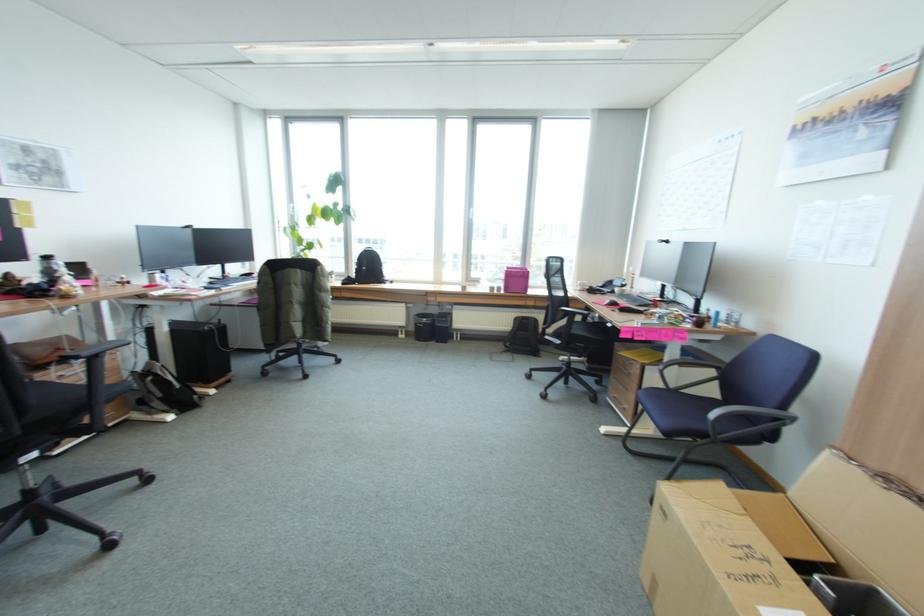
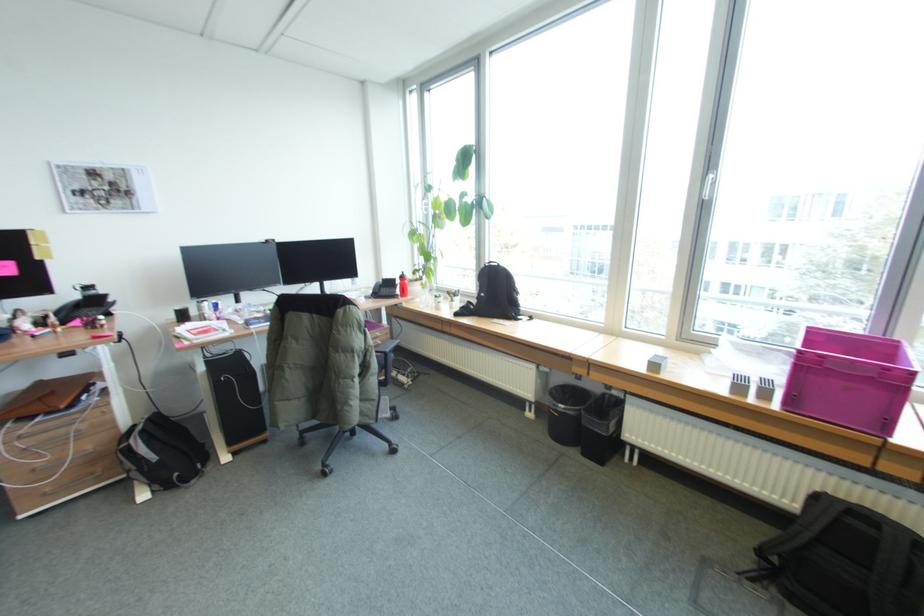
In the second image, find the point that corresponds to [443,342] in the first image.

(590, 455)